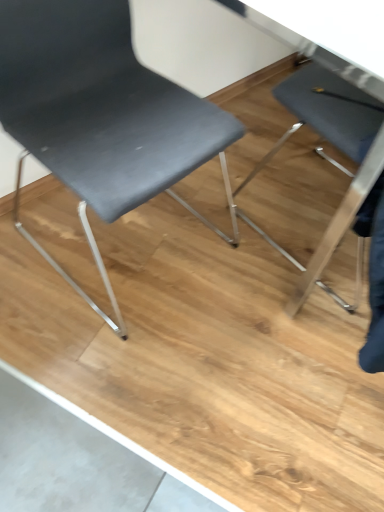
Image resolution: width=384 pixels, height=512 pixels. Identify the location of free space on the front side of matte black chair at left, marked as the first chair in a left-to-right arrangement. (109, 379).